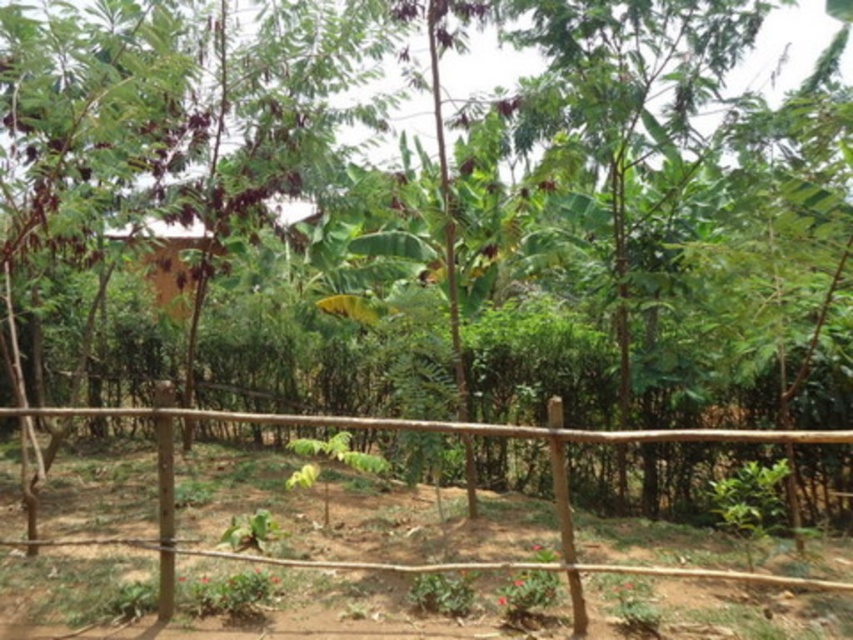
Question: Can you confirm if brown wooden fence at center is bigger than wooden hut at center?

Choices:
 (A) no
 (B) yes

Answer: (A)

Question: Does brown wooden fence at center have a greater width compared to wooden hut at center?

Choices:
 (A) yes
 (B) no

Answer: (B)

Question: Does brown wooden fence at center appear over wooden hut at center?

Choices:
 (A) no
 (B) yes

Answer: (A)

Question: Which object is closer to the camera taking this photo?

Choices:
 (A) wooden hut at center
 (B) brown wooden fence at center

Answer: (B)

Question: Which point is closer to the camera taking this photo?

Choices:
 (A) (161, 577)
 (B) (193, 243)

Answer: (A)